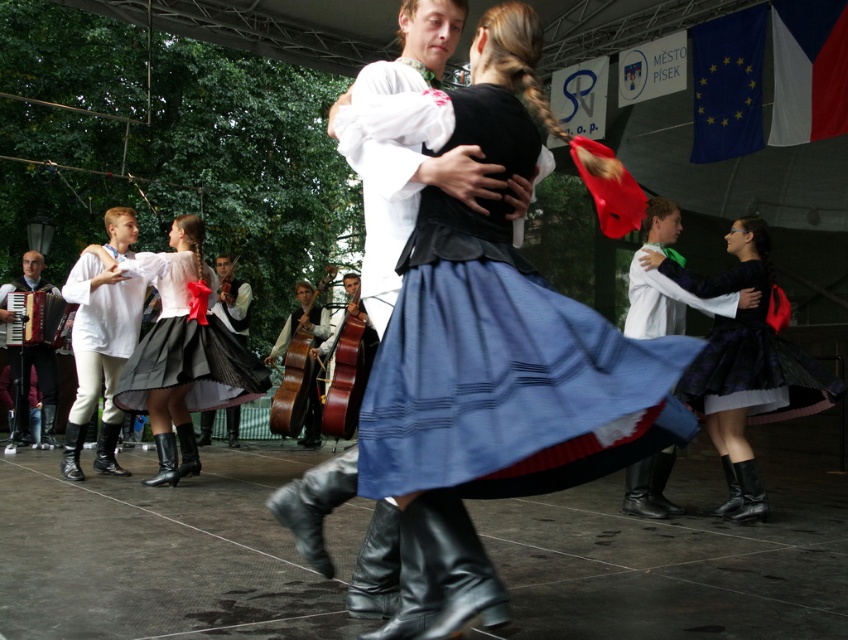
Question: Does plaid fabric dress at center lie in front of matte white accordion at left?

Choices:
 (A) yes
 (B) no

Answer: (A)

Question: In this image, where is white cotton shirt at left located relative to matte white accordion at left?

Choices:
 (A) below
 (B) above

Answer: (B)

Question: Which point appears closest to the camera in this image?

Choices:
 (A) 735,388
 (B) 667,436
 (C) 36,352
 (D) 142,300

Answer: (B)

Question: Among these points, which one is nearest to the camera?

Choices:
 (A) (762, 276)
 (B) (804, 369)

Answer: (B)

Question: From the image, what is the correct spatial relationship of matte black skirt at center in relation to wooden polished cello at center?

Choices:
 (A) left
 (B) right

Answer: (A)

Question: Which object is positioned farthest from the white cotton shirt at left?

Choices:
 (A) matte black skirt at center
 (B) plaid fabric dress at center
 (C) black satin skirt at right

Answer: (B)